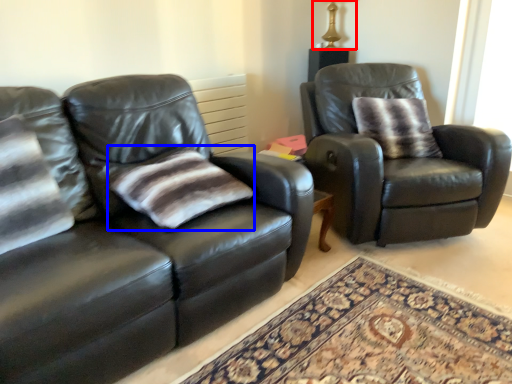
Question: Which point is closer to the camera, table lamp (highlighted by a red box) or pillow (highlighted by a blue box)?

Choices:
 (A) table lamp
 (B) pillow

Answer: (B)